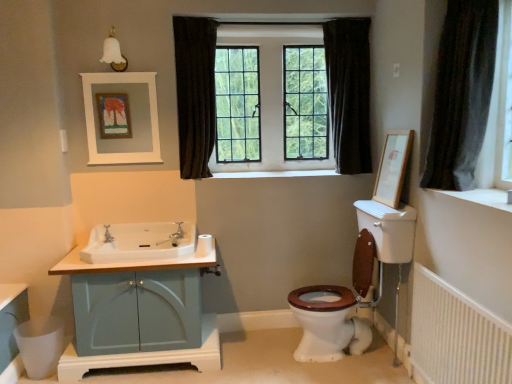
Identify the location of vacant location below clear glass windows at center (from a real-world perspective). (285, 168).